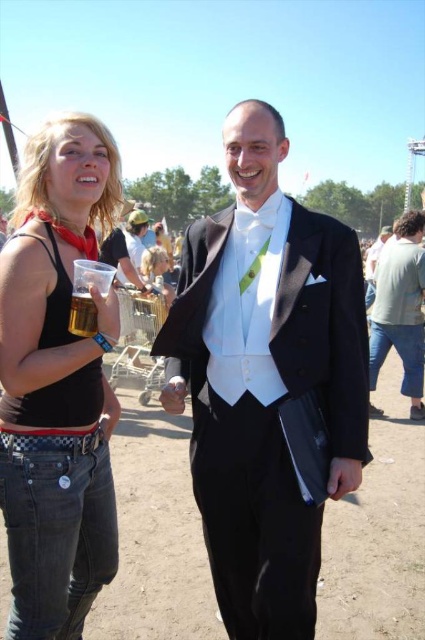
Which is more to the left, black satin tuxedo at center or matte black tank top at left?

From the viewer's perspective, matte black tank top at left appears more on the left side.

Does black satin tuxedo at center have a lesser height compared to matte black tank top at left?

No, black satin tuxedo at center is not shorter than matte black tank top at left.

Identify the location of black satin tuxedo at center. This screenshot has height=640, width=425. (268, 381).

The width and height of the screenshot is (425, 640). I want to click on black satin tuxedo at center, so click(268, 381).

Does black satin tuxedo at center have a lesser width compared to translucent plastic cup at lower left?

In fact, black satin tuxedo at center might be wider than translucent plastic cup at lower left.

Based on the photo, is black satin tuxedo at center to the right of translucent plastic cup at lower left from the viewer's perspective?

Yes, black satin tuxedo at center is to the right of translucent plastic cup at lower left.

Is point (300, 500) in front of point (85, 300)?

No, (300, 500) is behind (85, 300).

Locate an element on the screen. The width and height of the screenshot is (425, 640). black satin tuxedo at center is located at coordinates (268, 381).

Does matte black tank top at left appear over translucent plastic cup at lower left?

Actually, matte black tank top at left is below translucent plastic cup at lower left.

Based on the photo, between matte black tank top at left and translucent plastic cup at lower left, which one appears on the left side from the viewer's perspective?

From the viewer's perspective, matte black tank top at left appears more on the left side.

Find the location of `matte black tank top at left`. matte black tank top at left is located at coordinates (56, 385).

You are a GUI agent. You are given a task and a screenshot of the screen. Output one action in this format:
    pyautogui.click(x=<x>, y=<y>)
    Task: Click on the matte black tank top at left
    Image resolution: width=425 pixels, height=640 pixels.
    Given the screenshot: What is the action you would take?
    pyautogui.click(x=56, y=385)